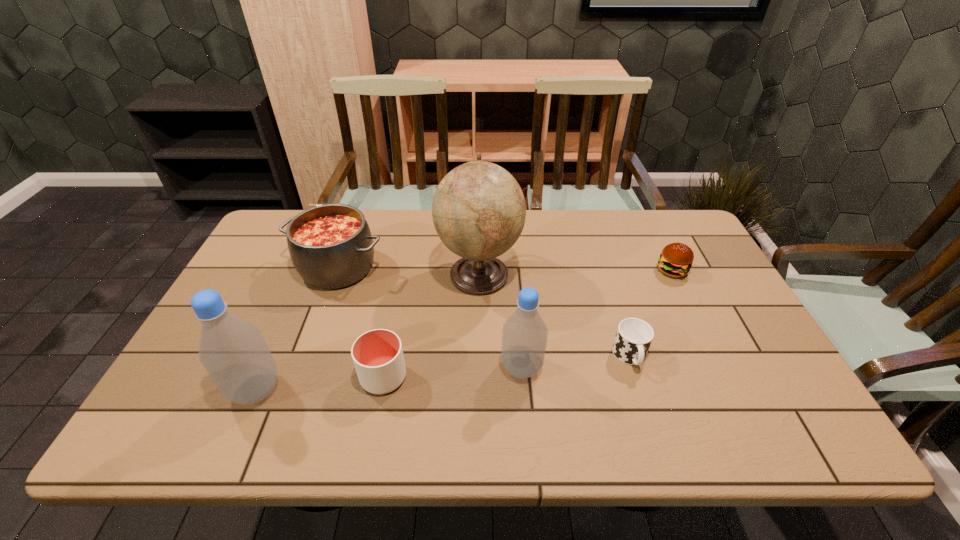
Where is `the left cup`? The image size is (960, 540). the left cup is located at coordinates (378, 358).

Locate an element on the screen. blank space located 0.310m on the right of the taller bottle is located at coordinates (418, 389).

What are the coordinates of `vacant space located 0.150m on the left of the third tallest object` in the screenshot? It's located at (438, 367).

At what (x,y) coordinates should I click in order to perform the action: click on vacant space situated on the back of the rightmost object. Please return your answer as a coordinate pair (x, y). The width and height of the screenshot is (960, 540). Looking at the image, I should click on (653, 231).

Identify the location of free point located on the front of the fourth shortest object. The image size is (960, 540). (310, 344).

You are a GUI agent. You are given a task and a screenshot of the screen. Output one action in this format:
    pyautogui.click(x=<x>, y=<y>)
    Task: Click on the vacant area situated 0.080m on the front-facing side of the globe
    The width and height of the screenshot is (960, 540).
    Given the screenshot: What is the action you would take?
    pyautogui.click(x=547, y=274)

The image size is (960, 540). What are the coordinates of `free space located 0.080m on the side of the shorter cup with the handle` in the screenshot? It's located at (645, 405).

Locate an element on the screen. free space located on the back of the taller cup is located at coordinates (398, 298).

Where is `casserole that is at the far edge`? The height and width of the screenshot is (540, 960). casserole that is at the far edge is located at coordinates (331, 246).

Image resolution: width=960 pixels, height=540 pixels. Find the location of `globe at the far edge`. globe at the far edge is located at coordinates (478, 210).